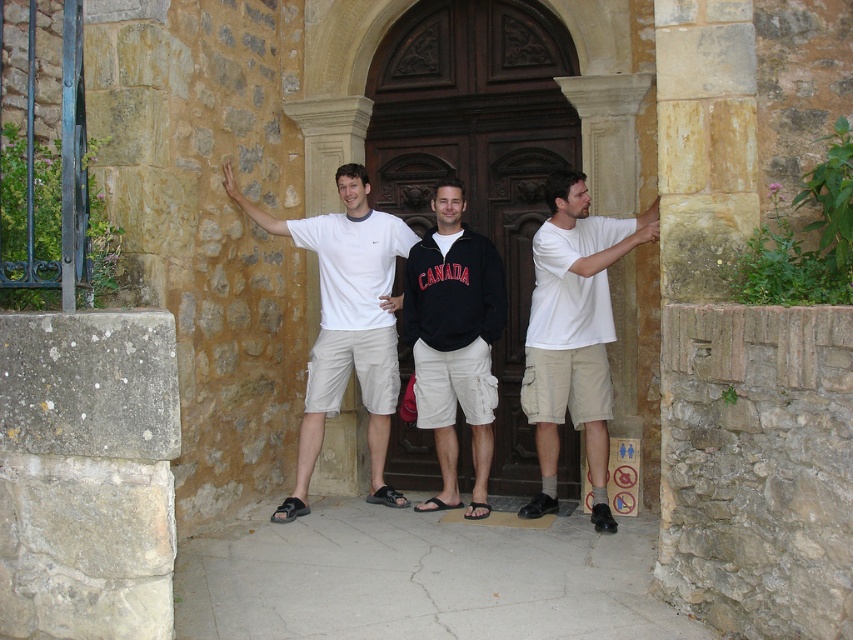
Question: Which of the following is the closest to the observer?

Choices:
 (A) white matte t-shirt at center
 (B) dark wood door at center

Answer: (A)

Question: Is white matte t-shirt at center smaller than black cotton sweatshirt at center?

Choices:
 (A) no
 (B) yes

Answer: (A)

Question: Which object is closer to the camera taking this photo?

Choices:
 (A) black cotton sweatshirt at center
 (B) white matte t-shirt at center

Answer: (B)

Question: Considering the relative positions of dark wood door at center and white matte t-shirt at center in the image provided, where is dark wood door at center located with respect to white matte t-shirt at center?

Choices:
 (A) below
 (B) above

Answer: (B)

Question: Which of these objects is positioned closest to the white matte t-shirt at center?

Choices:
 (A) dark wood door at center
 (B) white cotton t-shirt at right

Answer: (A)

Question: Can you confirm if dark wood door at center is bigger than white cotton t-shirt at right?

Choices:
 (A) yes
 (B) no

Answer: (A)